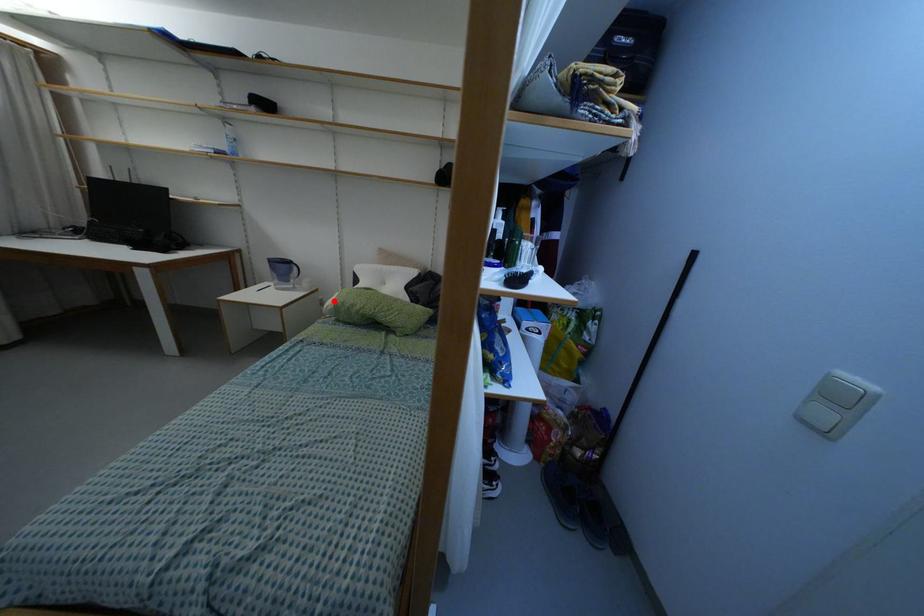
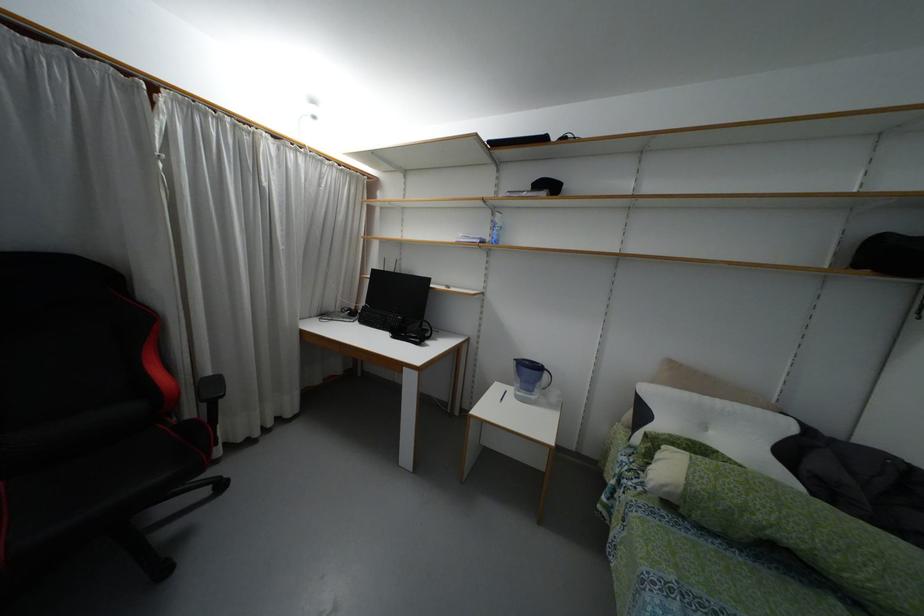
Locate, in the second image, the point that corresponds to the highlighted location in the first image.

(687, 483)